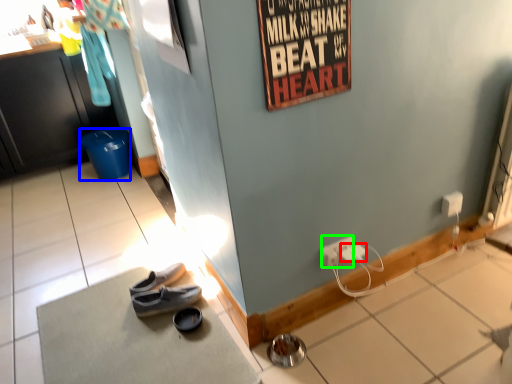
Question: Based on their relative distances, which object is farther from power outlet (highlighted by a red box)? Choose from trash bin/can (highlighted by a blue box) and power outlet (highlighted by a green box).

Choices:
 (A) trash bin/can
 (B) power outlet

Answer: (A)